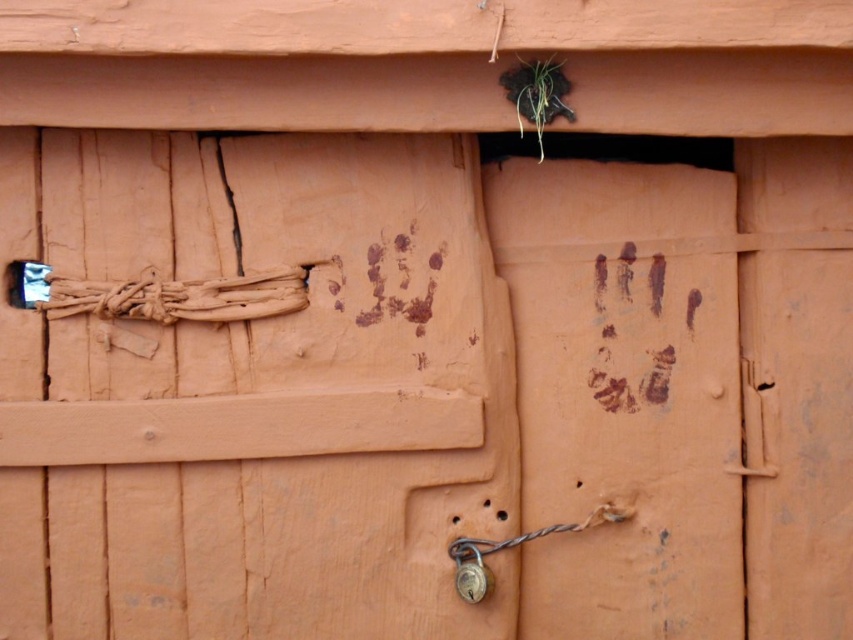
Question: Which object is positioned farthest from the metallic padlock at center?

Choices:
 (A) brown rope at left
 (B) wooden door handle at right
 (C) brass metallic padlock at bottom center

Answer: (A)

Question: Does matte clay handprint at center appear on the right side of brass metallic padlock at bottom center?

Choices:
 (A) yes
 (B) no

Answer: (B)

Question: Estimate the real-world distances between objects in this image. Which object is farther from the matte clay handprint at center?

Choices:
 (A) wooden door handle at right
 (B) brown rope at left
 (C) brass metallic padlock at bottom center
 (D) metallic padlock at center

Answer: (A)

Question: Is brass metallic padlock at bottom center thinner than metallic padlock at center?

Choices:
 (A) no
 (B) yes

Answer: (A)

Question: Which object is farther from the camera taking this photo?

Choices:
 (A) wooden door handle at right
 (B) matte clay handprint at center
 (C) brown rope at left

Answer: (A)

Question: Observing the image, what is the correct spatial positioning of brass metallic padlock at bottom center in reference to wooden door handle at right?

Choices:
 (A) right
 (B) left

Answer: (B)